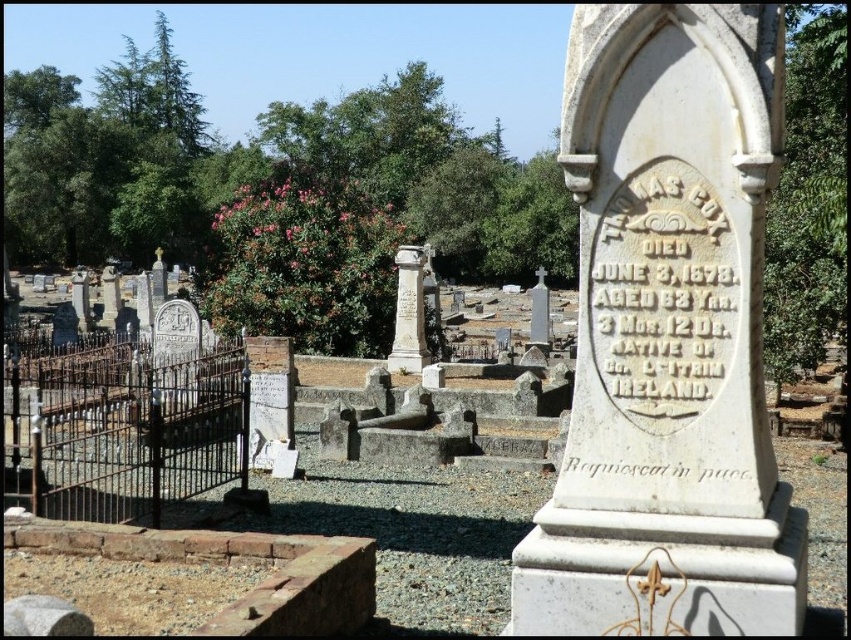
You are standing in front of the weathered white gravestone of Thomas Cox in the cemetery. There are two points marked on the gravestone at coordinates point (837, 593) and point (547, 298). Which point is closer to you?

Point (837, 593) is closer to the viewer than point (547, 298).

You are a groundskeeper tasked with maintaining the cemetery. You need to place a new flowerpot between the white marble column at center and the white stone cross at center. Which object should you place the flowerpot closer to if you want it to be near the smaller object?

You should place the flowerpot closer to the white marble column at center because it occupies less space than the white stone cross at center.

You are standing at the entrance of the cemetery and see the white stone monument at center and the white stone gravestone at center. Which one is closer to you?

The white stone monument at center is closer to you because it is in front of the white stone gravestone at center.